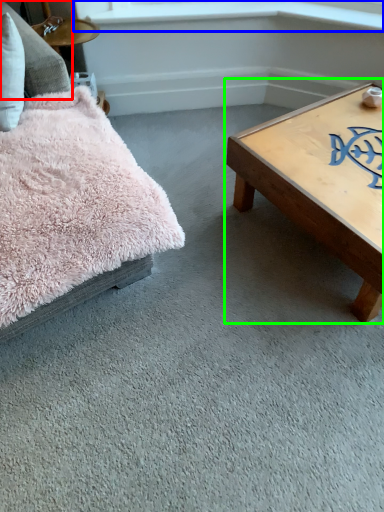
Question: Which object is the closest to the pillow (highlighted by a red box)? Choose among these: window sill (highlighted by a blue box) or coffee table (highlighted by a green box).

Choices:
 (A) window sill
 (B) coffee table

Answer: (A)